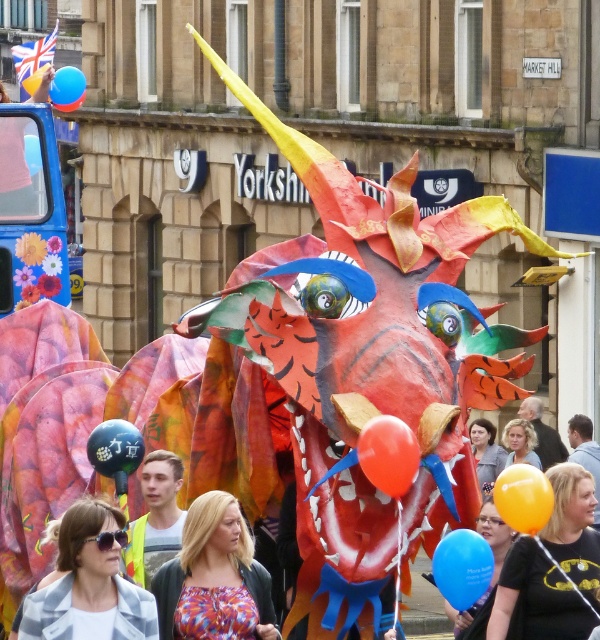
You are a photographer standing in the middle of the street, and you want to take a photo of both the rubber balloon at center and the blue glossy balloon at upper left. Which balloon will appear larger in your photo?

The rubber balloon at center will appear larger in the photo because it is closer to the viewer than the blue glossy balloon at upper left.

Consider the image. You are a photographer trying to capture a photo of the rubber balloon at center and the blue glossy balloon at upper left. You want to ensure both are in the frame. Based on their positions, which balloon should you focus on first to include both in your shot?

The rubber balloon at center is positioned on the right side of blue glossy balloon at upper left, so focusing on the blue glossy balloon at upper left first would help ensure both are in the frame since the rubber balloon at center is to its right.

You are an event planner observing the parade float. There is a multicolored fabric at center marked by point (214, 577). What is the primary color of this fabric?

The multicolored fabric at center marked by point (214, 577) is primarily red, orange, and yellow.